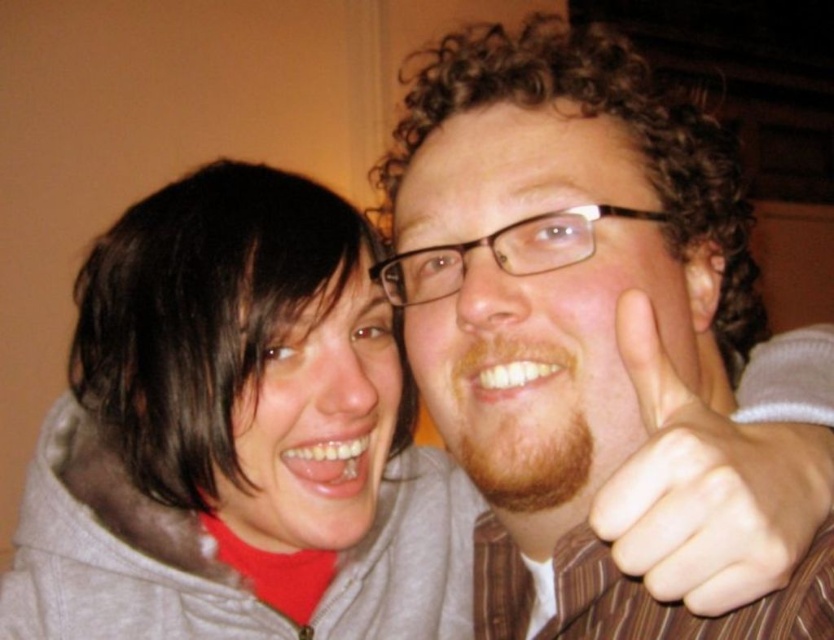
Can you confirm if matte gray hoodie at center is taller than skinny white hand at right?

Yes.

Is point (290, 337) positioned before point (817, 493)?

No, (290, 337) is further to viewer.

Identify the location of matte gray hoodie at center. The image size is (834, 640). tap(237, 436).